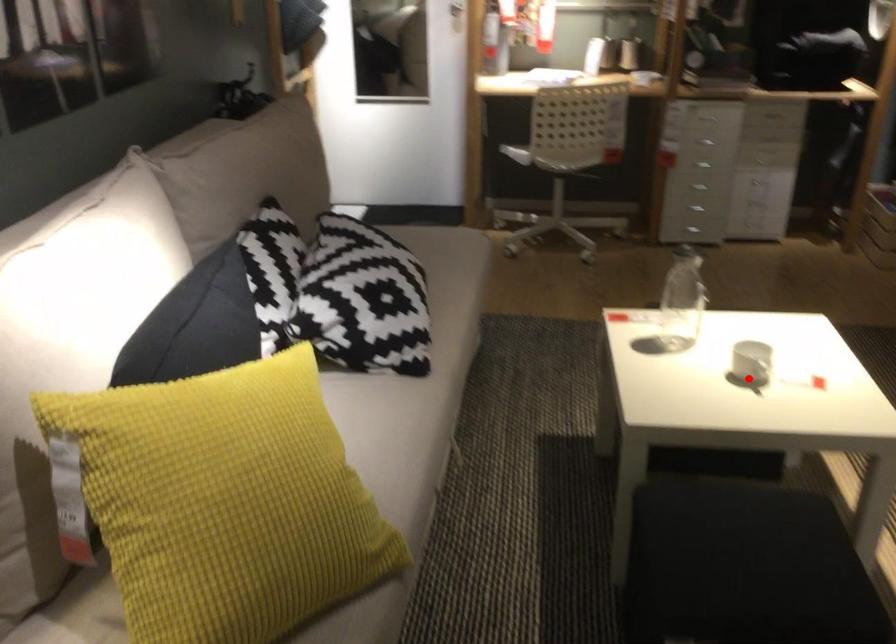
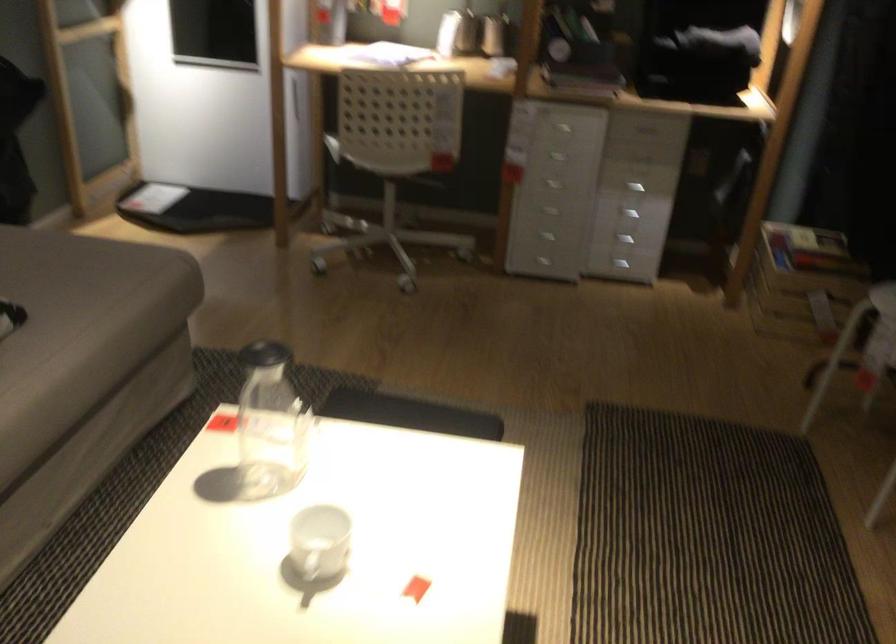
In the second image, find the point that corresponds to the highlighted location in the first image.

(320, 542)